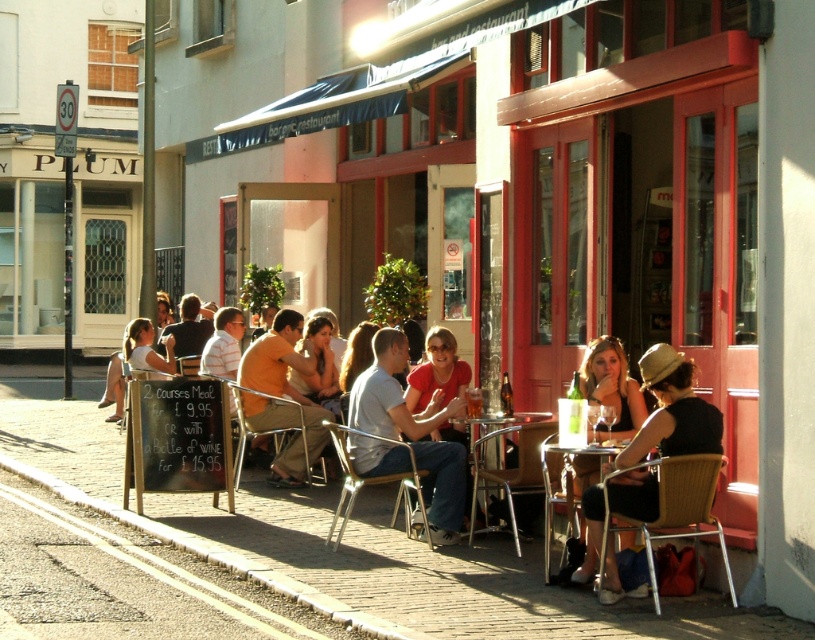
You are a photographer standing at the edge of the cobblestone street and want to capture both the matte black dress at lower right and the translucent glass beer at center in your photo. Which object will appear larger in the photo?

The matte black dress at lower right is closer to the viewer than the translucent glass beer at center, so it will appear larger in the photo.

You are a fashion designer observing the scene. You notice the matte black dress at lower right and the matte yellow shirt at center. Which clothing item is shorter in length?

The matte black dress at lower right is shorter than the matte yellow shirt at center.

You are a photographer standing at the edge of the cobblestone street. You want to take a photo of the translucent glass beer at center without the matte black dress at lower right appearing in the frame. Is this possible based on their positions?

The matte black dress at lower right is located below the translucent glass beer at center, so if you position yourself to capture the translucent glass beer at center while avoiding the lower right area, it should be possible to exclude the matte black dress at lower right from the frame.